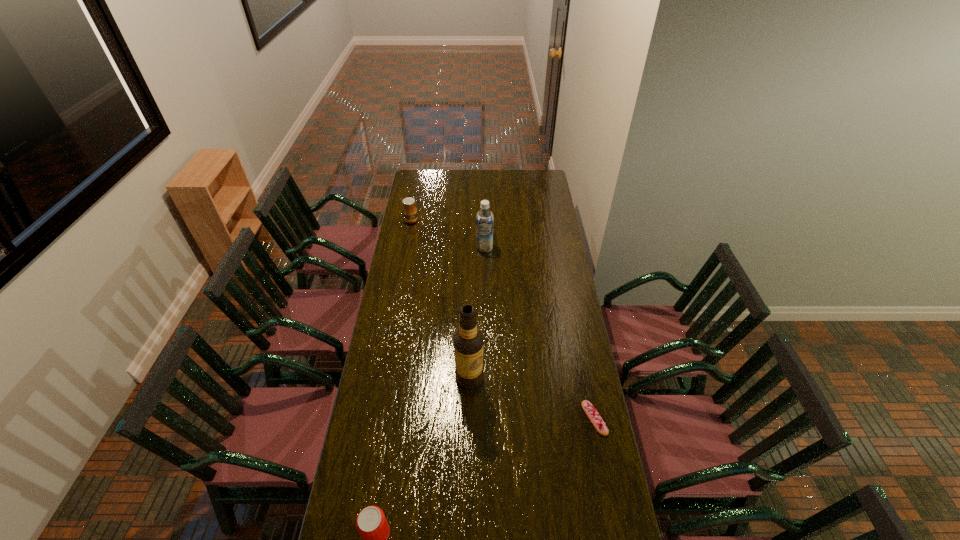
Find the location of a particular element. The width and height of the screenshot is (960, 540). blank space located 0.400m on the label of the tallest object is located at coordinates (504, 489).

Identify the location of free space located on the front-facing side of the honey. (421, 244).

You are a GUI agent. You are given a task and a screenshot of the screen. Output one action in this format:
    pyautogui.click(x=<x>, y=<y>)
    Task: Click on the blank area located 0.280m on the front-facing side of the honey
    The height and width of the screenshot is (540, 960).
    Given the screenshot: What is the action you would take?
    pyautogui.click(x=427, y=254)

The width and height of the screenshot is (960, 540). Find the location of `vacant space located 0.160m on the front-facing side of the honey`. vacant space located 0.160m on the front-facing side of the honey is located at coordinates (420, 241).

Find the location of `free space located 0.140m on the label of the second tallest object`. free space located 0.140m on the label of the second tallest object is located at coordinates (483, 271).

Locate an element on the screen. The image size is (960, 540). vacant position located 0.250m on the label of the second tallest object is located at coordinates (482, 286).

The width and height of the screenshot is (960, 540). I want to click on vacant space located on the label of the second tallest object, so click(x=483, y=268).

The width and height of the screenshot is (960, 540). Identify the location of object that is at the left edge. (409, 210).

Find the location of a particular element. This screenshot has height=540, width=960. object at the right edge is located at coordinates (591, 412).

Locate an element on the screen. This screenshot has height=540, width=960. vacant space at the far edge of the desktop is located at coordinates (482, 180).